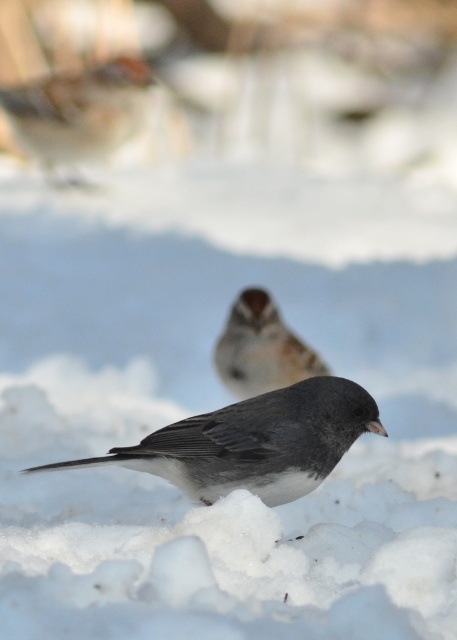
Can you confirm if dark gray matte bird at center is positioned above brown speckled sparrow at center?

No, dark gray matte bird at center is not above brown speckled sparrow at center.

Which is behind, point (158, 451) or point (260, 324)?

Point (260, 324)

Measure the distance between dark gray matte bird at center and camera.

The distance of dark gray matte bird at center from camera is 1.98 meters.

Locate an element on the screen. dark gray matte bird at center is located at coordinates (254, 442).

Is dark gray matte bird at center smaller than brown speckled feathers at upper left?

Indeed, dark gray matte bird at center has a smaller size compared to brown speckled feathers at upper left.

Find the location of a particular element. The width and height of the screenshot is (457, 640). dark gray matte bird at center is located at coordinates (254, 442).

Where is `dark gray matte bird at center`? The width and height of the screenshot is (457, 640). dark gray matte bird at center is located at coordinates (254, 442).

At what (x,y) coordinates should I click in order to perform the action: click on dark gray matte bird at center. Please return your answer as a coordinate pair (x, y). This screenshot has width=457, height=640. Looking at the image, I should click on (254, 442).

Consider the image. Does brown speckled feathers at upper left have a larger size compared to brown speckled sparrow at center?

Indeed, brown speckled feathers at upper left has a larger size compared to brown speckled sparrow at center.

Measure the distance between point (111,134) and camera.

A distance of 12.64 feet exists between point (111,134) and camera.

Where is `brown speckled feathers at upper left`? Image resolution: width=457 pixels, height=640 pixels. brown speckled feathers at upper left is located at coordinates (79, 109).

The width and height of the screenshot is (457, 640). I want to click on brown speckled feathers at upper left, so click(x=79, y=109).